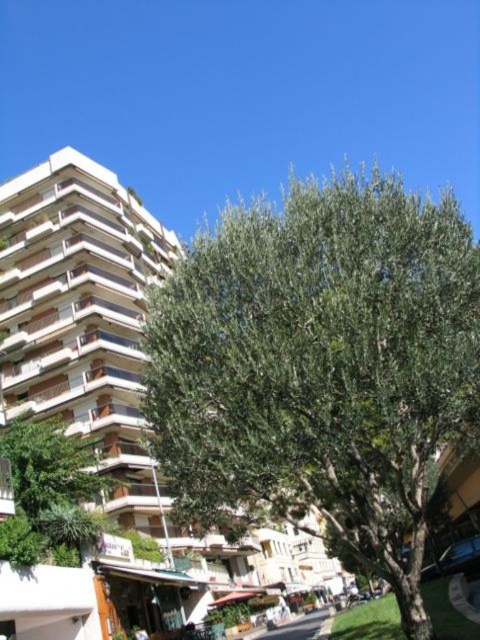
Looking at this image, you are standing in the middle of a park and see the green leafy tree at center and the white textured building at center. Which object is nearer to you?

The green leafy tree at center is closer to the viewer than the white textured building at center.

You are a city planner assessing a new pedestrian path. The path must be at least 15 meters wide to accommodate benches and trees. Based on the scene, can the space between the green leafy tree at center and the white textured building at center support this path?

The distance between the green leafy tree at center and the white textured building at center is 14.10 meters, which is less than the required 15 meters. Therefore, the space cannot support the proposed pedestrian path.

You are standing in the middle of the urban scene. There is a point marked at coordinates (320, 369). What object is located at that point?

The point at coordinates (320, 369) marks the green leafy tree at center.